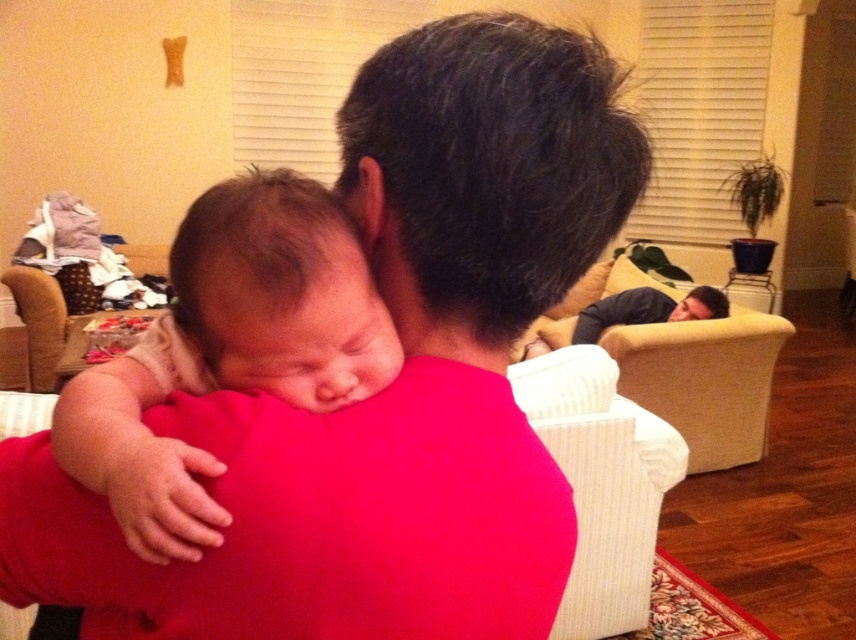
Question: Which point is farther to the camera?

Choices:
 (A) soft beige baby at center
 (B) white textured armchair at lower center

Answer: (B)

Question: Which is farther from the white textured armchair at lower center?

Choices:
 (A) soft beige baby at center
 (B) matte pink shirt at center

Answer: (A)

Question: Does matte pink shirt at center come in front of white textured armchair at lower center?

Choices:
 (A) yes
 (B) no

Answer: (A)

Question: Which point appears farthest from the camera in this image?

Choices:
 (A) (443, 589)
 (B) (236, 305)

Answer: (B)

Question: Does soft beige baby at center have a lesser width compared to white textured armchair at lower center?

Choices:
 (A) yes
 (B) no

Answer: (A)

Question: Can you confirm if matte pink shirt at center is positioned to the left of white textured armchair at lower center?

Choices:
 (A) yes
 (B) no

Answer: (A)